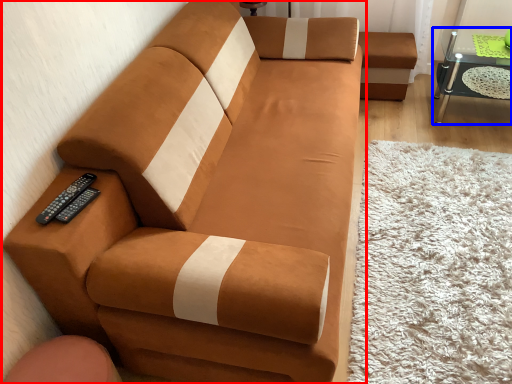
Question: Which point is closer to the camera, studio couch (highlighted by a red box) or table (highlighted by a blue box)?

Choices:
 (A) studio couch
 (B) table

Answer: (A)